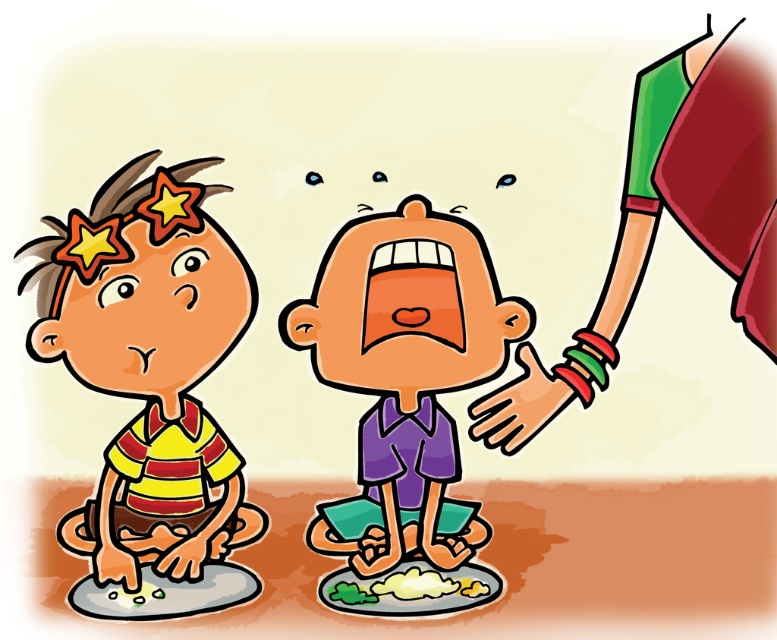
Measure the distance between yellow striped shirt at left and purple matte shirt at center.

yellow striped shirt at left and purple matte shirt at center are 8.74 inches apart.

Is yellow striped shirt at left below purple matte shirt at center?

No, yellow striped shirt at left is not below purple matte shirt at center.

Is point (207, 241) farther from camera compared to point (382, 576)?

Yes.

I want to click on yellow striped shirt at left, so click(x=152, y=388).